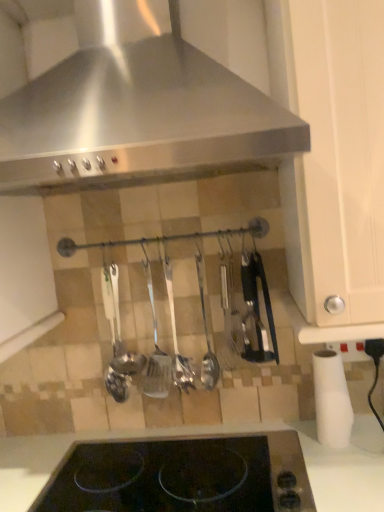
Question: Can you confirm if white matte cabinet at right is wider than polished metal ladle at center, arranged as the 1th silverware when viewed from the right?

Choices:
 (A) yes
 (B) no

Answer: (A)

Question: Considering the relative sizes of white matte cabinet at right and polished metal ladle at center, the third silverware when ordered from left to right, in the image provided, is white matte cabinet at right taller than polished metal ladle at center, the third silverware when ordered from left to right,?

Choices:
 (A) yes
 (B) no

Answer: (A)

Question: Considering the relative positions of white matte cabinet at right and polished metal ladle at center, the third silverware when ordered from left to right, in the image provided, is white matte cabinet at right to the left of polished metal ladle at center, the third silverware when ordered from left to right, from the viewer's perspective?

Choices:
 (A) no
 (B) yes

Answer: (A)

Question: Does white matte cabinet at right have a larger size compared to polished metal ladle at center, arranged as the 1th silverware when viewed from the right?

Choices:
 (A) yes
 (B) no

Answer: (A)

Question: From the image's perspective, does white matte cabinet at right appear lower than polished metal ladle at center, the third silverware when ordered from left to right?

Choices:
 (A) no
 (B) yes

Answer: (A)

Question: Is white matte cabinet at right next to polished metal ladle at center, the third silverware when ordered from left to right, and touching it?

Choices:
 (A) no
 (B) yes

Answer: (A)

Question: From a real-world perspective, is white matte paper towel at lower right physically below polished metal ladle at center, arranged as the 1th silverware when viewed from the right?

Choices:
 (A) no
 (B) yes

Answer: (B)

Question: Is white matte paper towel at lower right bigger than polished metal ladle at center, arranged as the 1th silverware when viewed from the right?

Choices:
 (A) no
 (B) yes

Answer: (B)

Question: Does white matte paper towel at lower right touch polished metal ladle at center, arranged as the 1th silverware when viewed from the right?

Choices:
 (A) yes
 (B) no

Answer: (B)

Question: Is white matte paper towel at lower right facing away from polished metal ladle at center, arranged as the 1th silverware when viewed from the right?

Choices:
 (A) no
 (B) yes

Answer: (A)

Question: Can you confirm if white matte paper towel at lower right is positioned to the right of polished metal ladle at center, arranged as the 1th silverware when viewed from the right?

Choices:
 (A) no
 (B) yes

Answer: (B)

Question: Does white matte paper towel at lower right come in front of polished metal ladle at center, arranged as the 1th silverware when viewed from the right?

Choices:
 (A) yes
 (B) no

Answer: (A)

Question: Is white matte cabinet at right at the right side of polished metal ladle at center, marked as the 2th silverware in a right-to-left arrangement?

Choices:
 (A) no
 (B) yes

Answer: (B)